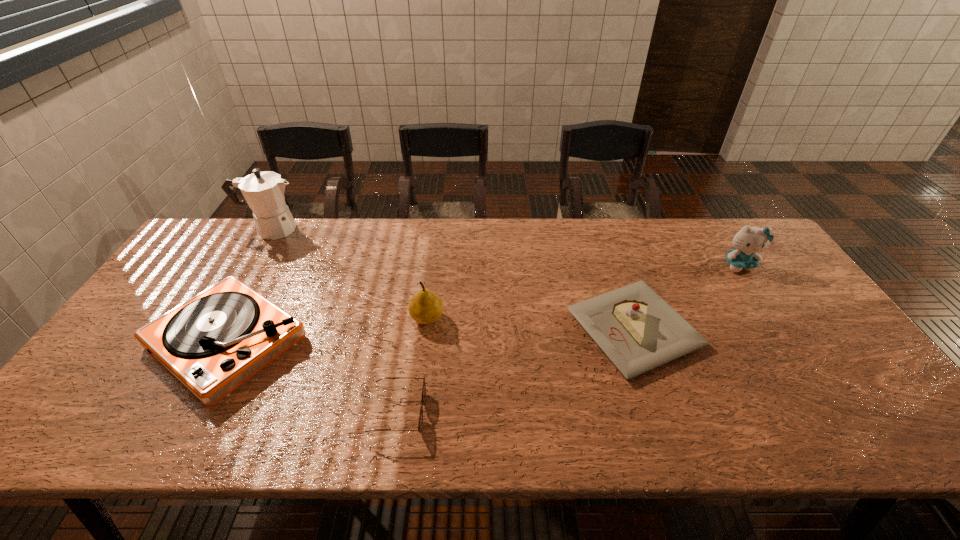
You are a GUI agent. You are given a task and a screenshot of the screen. Output one action in this format:
    pyautogui.click(x=<x>, y=<y>)
    Task: Click on the free space located 0.400m on the left of the pear
    The height and width of the screenshot is (540, 960).
    Given the screenshot: What is the action you would take?
    [264, 318]

The image size is (960, 540). I want to click on free location located on the back of the record player, so click(263, 275).

The image size is (960, 540). I want to click on free region located 0.350m on the left of the cake, so click(x=439, y=329).

Find the location of a particular element. free spot located 0.100m at the front view of the shortest object is located at coordinates (468, 413).

Image resolution: width=960 pixels, height=540 pixels. I want to click on coffeepot that is at the far edge, so click(263, 191).

Locate an element on the screen. kitten present at the far edge is located at coordinates (748, 241).

Where is `record player situated at the near edge`? The height and width of the screenshot is (540, 960). record player situated at the near edge is located at coordinates (212, 343).

Image resolution: width=960 pixels, height=540 pixels. In order to click on spectacles present at the near edge in this screenshot , I will do `click(420, 424)`.

Locate an element on the screen. The image size is (960, 540). coffeepot that is positioned at the left edge is located at coordinates (263, 191).

Find the location of a particular element. record player that is at the left edge is located at coordinates (212, 343).